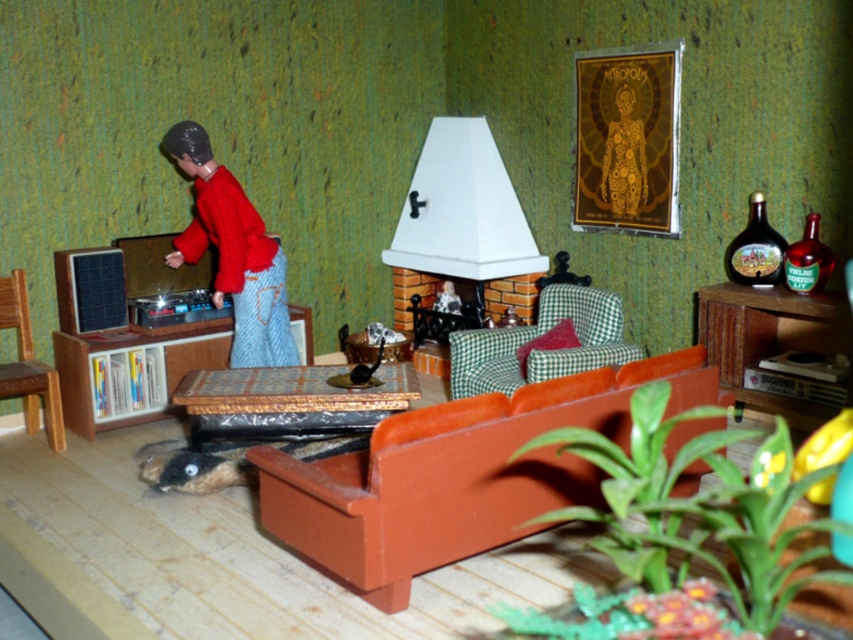
You are a small toy mouse that wants to hide under the sofa. The sofa is at the foreground. You see a point at coordinates (233, 252). Is this point under the sofa?

The point at coordinates (233, 252) corresponds to the matte red sweater at left, which is not under the sofa but placed on the sofa. Therefore, the point is not under the sofa.

You are arranging a miniature living room scene and need to place a tiny potted plant between the matte orange couch at center and the wooden cabinet at right. Based on their positions, where should you place the plant?

The matte orange couch at center is located below the wooden cabinet at right, so the plant should be placed between them horizontally, ensuring it sits in the middle area between the two objects.